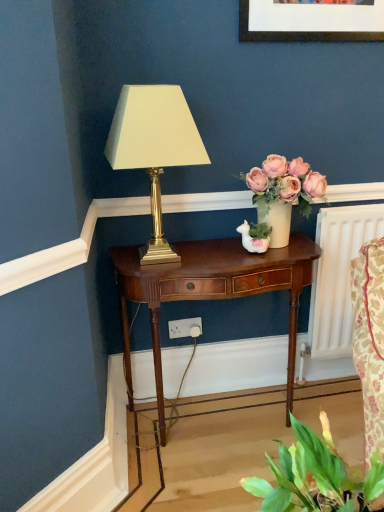
Question: Relative to gold metallic lamp at center, is matte cream vase with pink roses at center in front or behind?

Choices:
 (A) front
 (B) behind

Answer: (B)

Question: In terms of height, does matte cream vase with pink roses at center look taller or shorter compared to gold metallic lamp at center?

Choices:
 (A) short
 (B) tall

Answer: (A)

Question: Which object is positioned farthest from the gold metallic lamp at center?

Choices:
 (A) matte cream vase with pink roses at center
 (B) mahogany wood nightstand at center
 (C) green leafy plant at lower right

Answer: (C)

Question: Estimate the real-world distances between objects in this image. Which object is closer to the green leafy plant at lower right?

Choices:
 (A) mahogany wood nightstand at center
 (B) matte cream vase with pink roses at center
 (C) gold metallic lamp at center

Answer: (A)